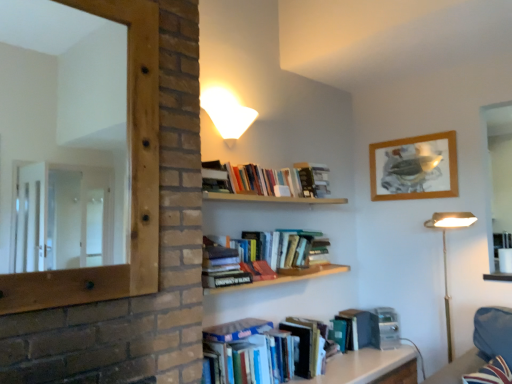
What do you see at coordinates (313, 179) in the screenshot?
I see `hardcover book at upper center, the second paperback book in the bottom-to-top sequence` at bounding box center [313, 179].

Image resolution: width=512 pixels, height=384 pixels. In order to click on wooden framed picture at upper right in this screenshot , I will do `click(414, 167)`.

Image resolution: width=512 pixels, height=384 pixels. Describe the element at coordinates (275, 181) in the screenshot. I see `hardcover books at upper center, which ranks as the first book in top-to-bottom order` at that location.

This screenshot has width=512, height=384. Describe the element at coordinates (361, 365) in the screenshot. I see `wooden table at lower center` at that location.

Find the location of a particular element. The image size is (512, 384). green matte paperback book at lower center, positioned as the second paperback book in left-to-right order is located at coordinates (360, 329).

At what (x,y) coordinates should I click in order to perform the action: click on hardcover book at upper center, which is the first paperback book from left to right. Please return your answer as a coordinate pair (x, y). Looking at the image, I should click on (313, 179).

Which is behind, green matte paperback book at lower center, arranged as the 2th paperback book when viewed from the top, or wooden mirror at left?

green matte paperback book at lower center, arranged as the 2th paperback book when viewed from the top, is behind.

Find the location of `window frame above the green matte paperback book at lower center, the first paperback book from the right (from the image's perspective)`. window frame above the green matte paperback book at lower center, the first paperback book from the right (from the image's perspective) is located at coordinates (130, 177).

Does green matte paperback book at lower center, positioned as the second paperback book in left-to-right order, turn towards wooden mirror at left?

No, green matte paperback book at lower center, positioned as the second paperback book in left-to-right order, is not facing towards wooden mirror at left.

Would you say wooden mirror at left is part of green matte paperback book at lower center, positioned as the second paperback book in left-to-right order,'s contents?

That's incorrect, wooden mirror at left is not inside green matte paperback book at lower center, positioned as the second paperback book in left-to-right order.

Is hardcover book at upper center, which is the second paperback book from right to left, behind gold metallic floor lamp at right?

Yes, it is behind gold metallic floor lamp at right.

In terms of width, does hardcover book at upper center, which is the first paperback book from left to right, look wider or thinner when compared to gold metallic floor lamp at right?

hardcover book at upper center, which is the first paperback book from left to right, is thinner than gold metallic floor lamp at right.

Would you say hardcover book at upper center, arranged as the first paperback book when viewed from the top, is to the left or to the right of gold metallic floor lamp at right in the picture?

From the image, it's evident that hardcover book at upper center, arranged as the first paperback book when viewed from the top, is to the left of gold metallic floor lamp at right.

Are hardcover book at upper center, the second paperback book in the bottom-to-top sequence, and gold metallic floor lamp at right located far from each other?

No, there isn't a large distance between hardcover book at upper center, the second paperback book in the bottom-to-top sequence, and gold metallic floor lamp at right.

Which object is wider, wooden framed picture at upper right or gold metallic floor lamp at right?

gold metallic floor lamp at right.

Between wooden framed picture at upper right and gold metallic floor lamp at right, which one is positioned behind?

wooden framed picture at upper right is further away from the camera.

Considering the sizes of objects wooden framed picture at upper right and gold metallic floor lamp at right in the image provided, who is shorter, wooden framed picture at upper right or gold metallic floor lamp at right?

With less height is wooden framed picture at upper right.

Is wooden mirror at left turned away from green matte paperback book at lower center, arranged as the 2th paperback book when viewed from the top?

No.

You are a GUI agent. You are given a task and a screenshot of the screen. Output one action in this format:
    pyautogui.click(x=<x>, y=<y>)
    Task: Click on the window frame in front of the green matte paperback book at lower center, positioned as the second paperback book in left-to-right order
    
    Given the screenshot: What is the action you would take?
    pyautogui.click(x=130, y=177)

From the image's perspective, does wooden mirror at left appear lower than green matte paperback book at lower center, the first paperback book from the right?

No.

Considering the positions of points (122, 2) and (377, 319), is point (122, 2) closer to camera compared to point (377, 319)?

Yes, point (122, 2) is closer to viewer.

Looking at this image, from the image's perspective, between gold metallic floor lamp at right and white glossy wall lamp at upper center, who is located below?

gold metallic floor lamp at right, from the image's perspective.

Who is more distant, gold metallic floor lamp at right or white glossy wall lamp at upper center?

gold metallic floor lamp at right is behind.

Considering the relative sizes of gold metallic floor lamp at right and white glossy wall lamp at upper center in the image provided, is gold metallic floor lamp at right wider than white glossy wall lamp at upper center?

Answer: Yes.

Are gold metallic floor lamp at right and white glossy wall lamp at upper center making contact?

No, gold metallic floor lamp at right is not next to white glossy wall lamp at upper center.

Is point (249, 124) closer to viewer compared to point (327, 190)?

That is True.

Looking at this image, considering the sizes of objects white glossy wall lamp at upper center and hardcover books at upper center, which ranks as the first book in top-to-bottom order, in the image provided, who is smaller, white glossy wall lamp at upper center or hardcover books at upper center, which ranks as the first book in top-to-bottom order,?

white glossy wall lamp at upper center.

Identify the location of the 1st book below the white glossy wall lamp at upper center (from the image's perspective). (275, 181).

Considering the relative positions of hardcover books at upper center, which ranks as the first book in top-to-bottom order, and white glossy wall lamp at upper center in the image provided, is hardcover books at upper center, which ranks as the first book in top-to-bottom order, to the right of white glossy wall lamp at upper center from the viewer's perspective?

Yes.

Is hardcover books at upper center, the 2th book when ordered from bottom to top, spatially inside white glossy wall lamp at upper center, or outside of it?

hardcover books at upper center, the 2th book when ordered from bottom to top, is spatially situated outside white glossy wall lamp at upper center.

Based on the photo, which of these two, hardcover books at upper center, which ranks as the first book in top-to-bottom order, or white glossy wall lamp at upper center, is wider?

white glossy wall lamp at upper center is wider.

Who is shorter, hardcover books at upper center, which ranks as the first book in top-to-bottom order, or white glossy wall lamp at upper center?

With less height is hardcover books at upper center, which ranks as the first book in top-to-bottom order.

Image resolution: width=512 pixels, height=384 pixels. In order to click on window frame above the green matte paperback book at lower center, arranged as the 2th paperback book when viewed from the top (from the image's perspective) in this screenshot , I will do `click(130, 177)`.

The height and width of the screenshot is (384, 512). Find the location of `table lamp in front of the hardcover book at upper center, arranged as the first paperback book when viewed from the top`. table lamp in front of the hardcover book at upper center, arranged as the first paperback book when viewed from the top is located at coordinates (446, 254).

When comparing their distances from hardcover book at upper center, the second paperback book in the bottom-to-top sequence, does white glossy wall lamp at upper center or hardcover books at upper center, the 2th book when ordered from bottom to top, seem further?

Among the two, white glossy wall lamp at upper center is located further to hardcover book at upper center, the second paperback book in the bottom-to-top sequence.

Looking at the image, which one is located further to hardcover book at upper center, the second paperback book in the bottom-to-top sequence, wooden mirror at left or white glossy wall lamp at upper center?

The object further to hardcover book at upper center, the second paperback book in the bottom-to-top sequence, is wooden mirror at left.

From the image, which object appears to be nearer to green matte paperback book at lower center, positioned as the second paperback book in left-to-right order, gold metallic floor lamp at right or wooden mirror at left?

The object closer to green matte paperback book at lower center, positioned as the second paperback book in left-to-right order, is gold metallic floor lamp at right.

Based on their spatial positions, is hardcover books at upper center, the 2th book when ordered from bottom to top, or hardcover book at upper center, arranged as the first paperback book when viewed from the top, closer to wooden mirror at left?

Among the two, hardcover books at upper center, the 2th book when ordered from bottom to top, is located nearer to wooden mirror at left.

Looking at the image, which one is located further to gold metallic floor lamp at right, hardcover book at upper center, arranged as the first paperback book when viewed from the top, or wooden framed picture at upper right?

Based on the image, hardcover book at upper center, arranged as the first paperback book when viewed from the top, appears to be further to gold metallic floor lamp at right.

Which object lies nearer to the anchor point hardcover book at upper center, the second paperback book in the bottom-to-top sequence, wooden table at lower center or green matte paperback book at lower center, positioned as the second paperback book in left-to-right order?

The object closer to hardcover book at upper center, the second paperback book in the bottom-to-top sequence, is green matte paperback book at lower center, positioned as the second paperback book in left-to-right order.

Which object lies further to the anchor point wooden table at lower center, gold metallic floor lamp at right or green matte paperback book at lower center, positioned as the second paperback book in left-to-right order?

gold metallic floor lamp at right is positioned further to the anchor wooden table at lower center.

From the image, which object appears to be farther from wooden table at lower center, green matte paperback book at lower center, arranged as the 2th paperback book when viewed from the top, or wooden mirror at left?

Among the two, wooden mirror at left is located further to wooden table at lower center.

Find the location of a particular element. This screenshot has height=384, width=512. lamp between hardcover books at upper center, the 2th book when ordered from bottom to top, and hardcover book at upper center, which is the second paperback book from right to left, in the front-back direction is located at coordinates (227, 113).

Locate an element on the screen. lamp between wooden mirror at left and wooden framed picture at upper right from left to right is located at coordinates (227, 113).

Identify the location of paperback book between wooden framed picture at upper right and green matte paperback book at lower center, arranged as the 2th paperback book when viewed from the top, vertically. This screenshot has width=512, height=384. (313, 179).

The image size is (512, 384). In order to click on book that lies between hardcover book at upper center, the second paperback book in the bottom-to-top sequence, and hardcover books at lower center, the 2th book positioned from the top, from top to bottom in this screenshot , I will do `click(275, 181)`.